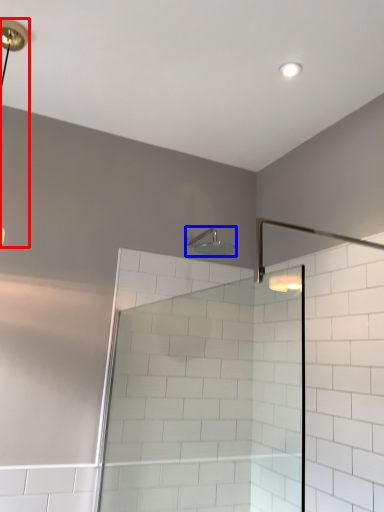
Question: Which object appears closest to the camera in this image, lamp (highlighted by a red box) or shower (highlighted by a blue box)?

Choices:
 (A) lamp
 (B) shower

Answer: (A)